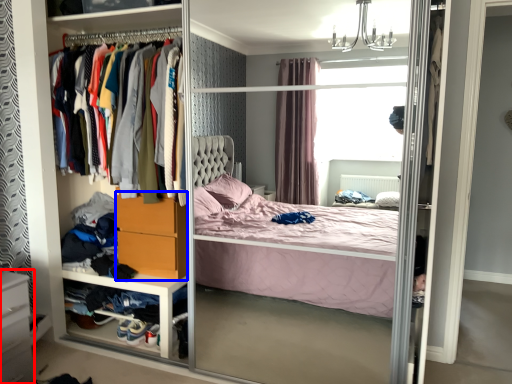
Question: Which point is closer to the camera, vanity (highlighted by a red box) or dresser (highlighted by a blue box)?

Choices:
 (A) vanity
 (B) dresser

Answer: (A)